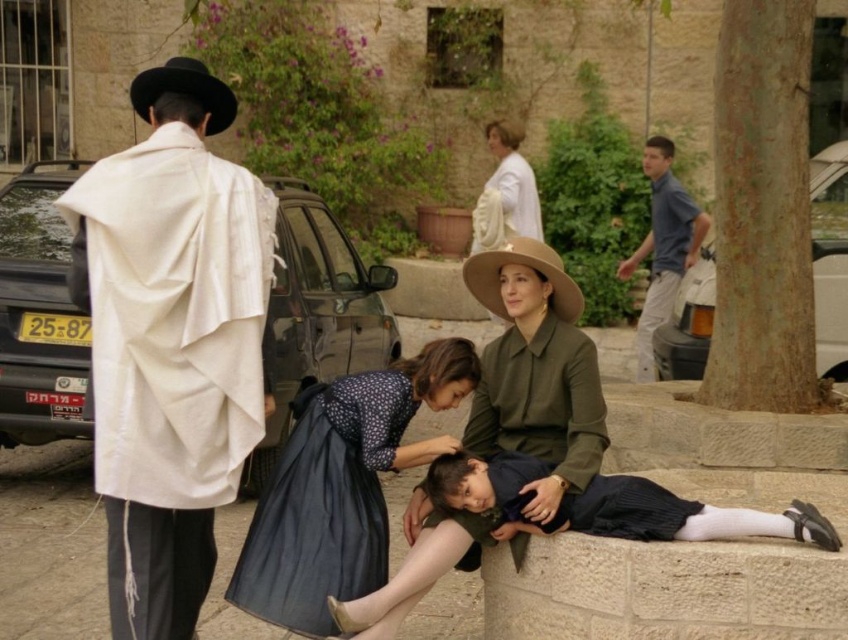
Question: Considering the relative positions of white textured coat at left and dark blue satin dress at lower center in the image provided, where is white textured coat at left located with respect to dark blue satin dress at lower center?

Choices:
 (A) right
 (B) left

Answer: (B)

Question: Is metallic silver car at right closer to the viewer compared to blue cotton shirt at right?

Choices:
 (A) no
 (B) yes

Answer: (B)

Question: Can you confirm if black glossy car at left is positioned below black felt cowboy hat at upper left?

Choices:
 (A) yes
 (B) no

Answer: (A)

Question: Estimate the real-world distances between objects in this image. Which object is farther from the white textured coat at left?

Choices:
 (A) white matte dress at upper center
 (B) blue cotton shirt at right

Answer: (A)

Question: Which point is closer to the camera?

Choices:
 (A) (171, 97)
 (B) (480, 193)
 (C) (141, 77)

Answer: (C)

Question: Which object is the farthest from the blue cotton shirt at right?

Choices:
 (A) black glossy car at left
 (B) dark blue satin dress at lower center
 (C) brown felt cowboy hat at center
 (D) white matte dress at upper center

Answer: (B)